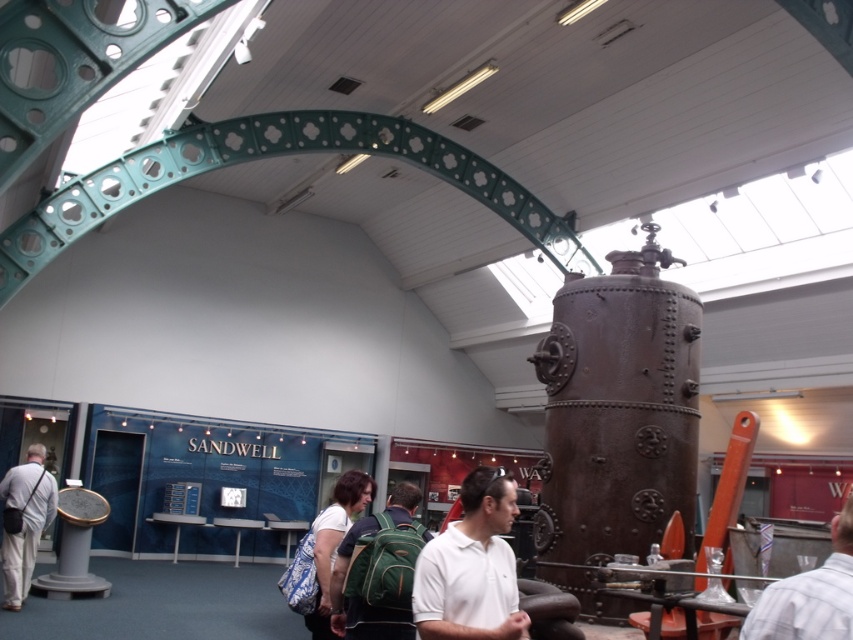
Which of these two, white matte shirt at center or green fabric backpack at center, stands taller?

green fabric backpack at center

Which is more to the left, white matte shirt at center or green fabric backpack at center?

Positioned to the left is green fabric backpack at center.

Between point (491, 496) and point (396, 484), which one is positioned behind?

The point (396, 484) is behind.

At what (x,y) coordinates should I click in order to perform the action: click on white matte shirt at center. Please return your answer as a coordinate pair (x, y). Looking at the image, I should click on (471, 568).

Who is positioned more to the left, striped shirt at center or light gray fabric jacket at left?

From the viewer's perspective, light gray fabric jacket at left appears more on the left side.

Consider the image. Can you confirm if striped shirt at center is positioned to the right of light gray fabric jacket at left?

Indeed, striped shirt at center is positioned on the right side of light gray fabric jacket at left.

Locate an element on the screen. This screenshot has width=853, height=640. striped shirt at center is located at coordinates (810, 595).

Looking at this image, between green fabric backpack at center and light gray fabric jacket at left, which one is positioned higher?

green fabric backpack at center is higher up.

Is green fabric backpack at center bigger than light gray fabric jacket at left?

Actually, green fabric backpack at center might be smaller than light gray fabric jacket at left.

The height and width of the screenshot is (640, 853). What do you see at coordinates (378, 572) in the screenshot?
I see `green fabric backpack at center` at bounding box center [378, 572].

Find the location of `green fabric backpack at center`. green fabric backpack at center is located at coordinates (378, 572).